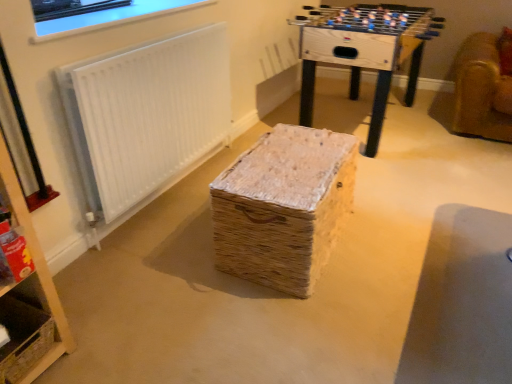
Question: Can you confirm if wooden foosball table at upper center is shorter than woven straw basket at lower left?

Choices:
 (A) yes
 (B) no

Answer: (B)

Question: Could you tell me if wooden foosball table at upper center is facing woven straw basket at lower left?

Choices:
 (A) yes
 (B) no

Answer: (B)

Question: From the image's perspective, is wooden foosball table at upper center on top of woven straw basket at lower left?

Choices:
 (A) no
 (B) yes

Answer: (B)

Question: Does wooden foosball table at upper center have a greater height compared to woven straw basket at lower left?

Choices:
 (A) no
 (B) yes

Answer: (B)

Question: Would you say woven straw basket at lower left is part of wooden foosball table at upper center's contents?

Choices:
 (A) no
 (B) yes

Answer: (A)

Question: Does wooden foosball table at upper center have a lesser width compared to woven straw basket at lower left?

Choices:
 (A) no
 (B) yes

Answer: (A)

Question: Considering the relative sizes of wooden foosball table at upper center and woven straw basket at center in the image provided, is wooden foosball table at upper center smaller than woven straw basket at center?

Choices:
 (A) yes
 (B) no

Answer: (B)

Question: From a real-world perspective, does wooden foosball table at upper center stand above woven straw basket at center?

Choices:
 (A) no
 (B) yes

Answer: (B)

Question: Are wooden foosball table at upper center and woven straw basket at center far apart?

Choices:
 (A) no
 (B) yes

Answer: (B)

Question: From the image's perspective, is wooden foosball table at upper center below woven straw basket at center?

Choices:
 (A) no
 (B) yes

Answer: (A)

Question: Is wooden foosball table at upper center thinner than woven straw basket at center?

Choices:
 (A) no
 (B) yes

Answer: (A)

Question: Considering the relative sizes of wooden foosball table at upper center and woven straw basket at center in the image provided, is wooden foosball table at upper center bigger than woven straw basket at center?

Choices:
 (A) yes
 (B) no

Answer: (A)

Question: Does white textured radiator at upper left have a lesser width compared to woven straw basket at center?

Choices:
 (A) yes
 (B) no

Answer: (A)